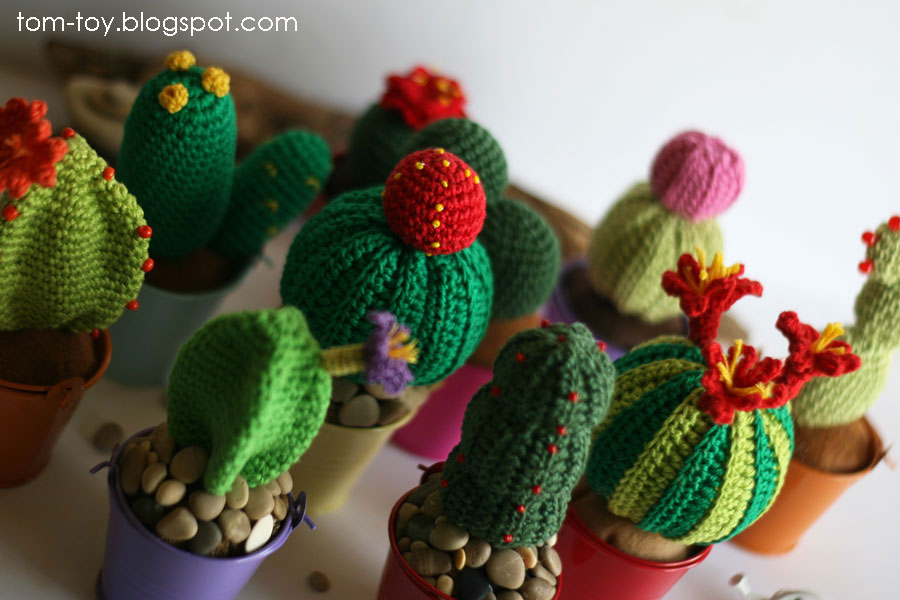
Image resolution: width=900 pixels, height=600 pixels. What are the coordinates of `crocheted cacti` in the screenshot? It's located at (69, 279), (159, 181), (505, 156), (464, 309), (207, 442), (644, 247), (721, 466), (849, 400).